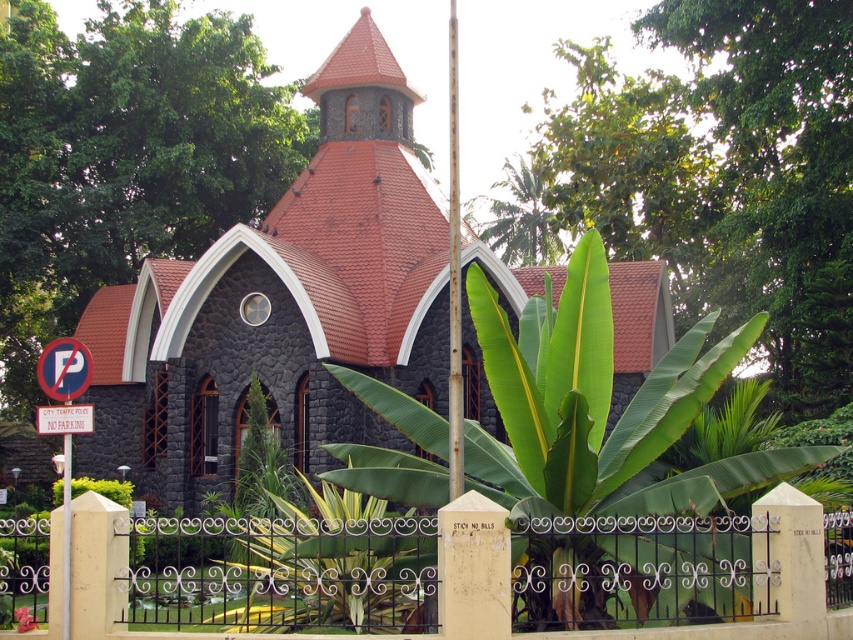
You are standing in front of the church and want to take a photo of both the dark gray stone church at center and the smooth white flag pole at center. Which one should you focus on first if you want to capture both in the frame without moving the camera?

You should focus on the dark gray stone church at center first because it is shorter than the smooth white flag pole at center, so you can adjust the camera angle to include both.

You are standing in front of the church and want to take a photo. There are two points marked in the image, point 1 at coordinates point [782,550] and point 2 at coordinates point [457,445]. Which point is closer to you when you are facing the church?

Point [782,550] is closer to the camera than point [457,445], so when facing the church, point 1 at coordinates point [782,550] is closer to you.